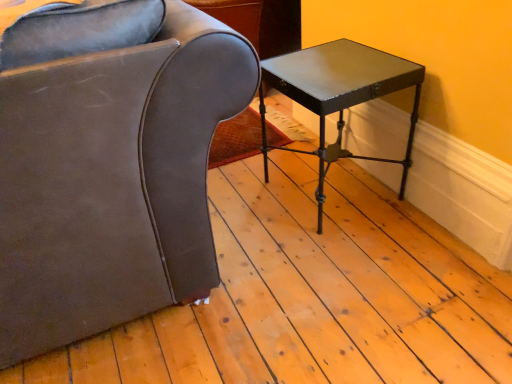
Question: Would you say glossy black table at right is to the left or to the right of brown leather chair at left in the picture?

Choices:
 (A) left
 (B) right

Answer: (B)

Question: Considering the positions of glossy black table at right and brown leather chair at left in the image, is glossy black table at right wider or thinner than brown leather chair at left?

Choices:
 (A) thin
 (B) wide

Answer: (A)

Question: Considering the positions of glossy black table at right and brown leather chair at left in the image, is glossy black table at right bigger or smaller than brown leather chair at left?

Choices:
 (A) small
 (B) big

Answer: (A)

Question: From the image's perspective, relative to glossy black table at right, is brown leather chair at left above or below?

Choices:
 (A) below
 (B) above

Answer: (B)

Question: Is brown leather chair at left bigger or smaller than glossy black table at right?

Choices:
 (A) big
 (B) small

Answer: (A)

Question: Is brown leather chair at left in front of or behind glossy black table at right in the image?

Choices:
 (A) behind
 (B) front

Answer: (B)

Question: Is brown leather chair at left inside the boundaries of glossy black table at right, or outside?

Choices:
 (A) outside
 (B) inside

Answer: (A)